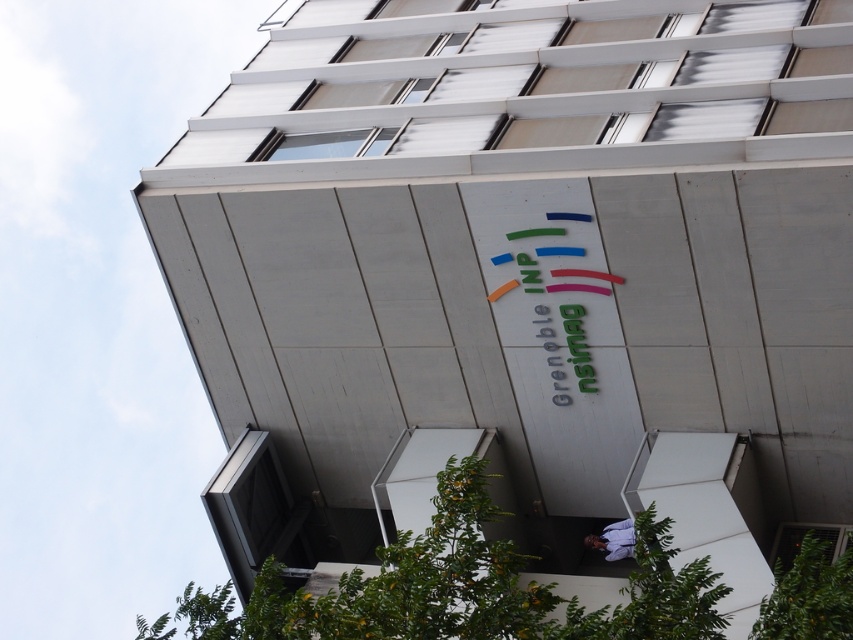
You are a photographer standing in front of the building. You want to take a photo that includes both the glossy plastic sign at center and the light blue shirt at lower center. Which object should you focus on first to ensure both are in frame?

The glossy plastic sign at center is bigger than the light blue shirt at lower center, so you should focus on the glossy plastic sign at center first to ensure both are in frame.